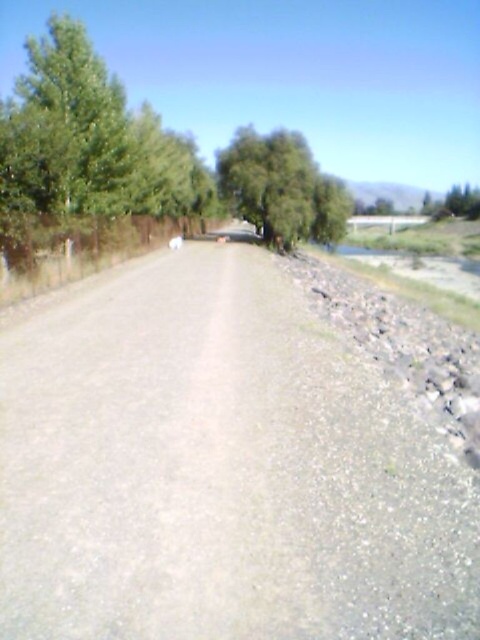
You are driving a car that is 2 meters wide. You see the gray gravel dirt track at center and the green leafy tree at center. Can your car fit between them?

The gray gravel dirt track at center is positioned on the left side of green leafy tree at center. Since the car is 2 meters wide, it depends on the distance between them. However, the description does not provide the exact distance, so we cannot determine if the car can fit.

You are standing at the origin point in the image, which is the bottom left corner. You want to walk to the gray gravel dirt track at center. In which direction should you move relative to your current position?

Since the gray gravel dirt track at center is located at point 0.736 on the x axis and 0.460 on the y axis, you should move northeast from your current position to reach it.

You are driving a car with a width of 1.8 meters along the gray gravel dirt track at center. There is a green leafy tree at center nearby. Can your car safely pass through the narrowest point of the track without hitting the tree?

The gray gravel dirt track at center is smaller than the green leafy tree at center. Since the track is narrower than the tree, it means the track itself is not wide enough for a car of 1.8 meters. Therefore, the car cannot safely pass through the narrowest point without risking collision with the tree.